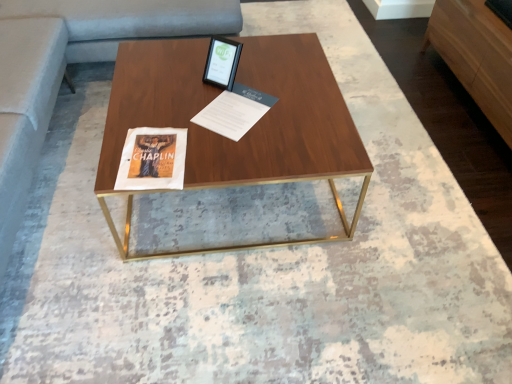
Question: Is walnut wood coffee table at center taller than white paper at center?

Choices:
 (A) yes
 (B) no

Answer: (A)

Question: From a real-world perspective, does walnut wood coffee table at center stand above white paper at center?

Choices:
 (A) yes
 (B) no

Answer: (B)

Question: Is white paper at center surrounded by walnut wood coffee table at center?

Choices:
 (A) no
 (B) yes

Answer: (B)

Question: From the image's perspective, is walnut wood coffee table at center above white paper at center?

Choices:
 (A) no
 (B) yes

Answer: (A)

Question: Is walnut wood coffee table at center positioned beyond the bounds of white paper at center?

Choices:
 (A) no
 (B) yes

Answer: (B)

Question: Can you confirm if walnut wood coffee table at center is bigger than white paper at center?

Choices:
 (A) no
 (B) yes

Answer: (B)

Question: Is light brown wood dresser at right a part of walnut wood coffee table at center?

Choices:
 (A) no
 (B) yes

Answer: (A)

Question: Does walnut wood coffee table at center have a greater height compared to light brown wood dresser at right?

Choices:
 (A) no
 (B) yes

Answer: (A)

Question: From a real-world perspective, is walnut wood coffee table at center physically above light brown wood dresser at right?

Choices:
 (A) yes
 (B) no

Answer: (B)

Question: Could you tell me if walnut wood coffee table at center is turned towards light brown wood dresser at right?

Choices:
 (A) yes
 (B) no

Answer: (A)

Question: Is walnut wood coffee table at center bigger than light brown wood dresser at right?

Choices:
 (A) yes
 (B) no

Answer: (A)

Question: Can we say walnut wood coffee table at center lies outside light brown wood dresser at right?

Choices:
 (A) no
 (B) yes

Answer: (B)

Question: From a real-world perspective, is walnut wood coffee table at center beneath matte black tablet at upper center?

Choices:
 (A) no
 (B) yes

Answer: (B)